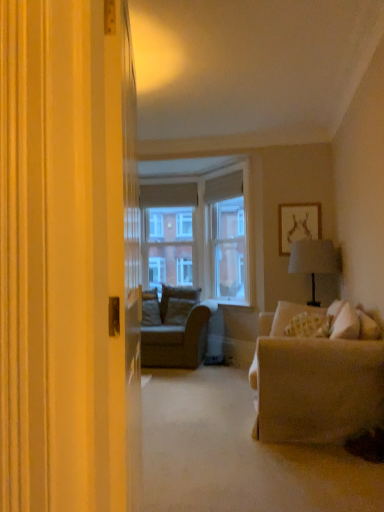
Question: Considering their positions, is textured beige couch at center located in front of or behind clear glass window screen at center, placed as the 1th window screen when sorted from front to back?

Choices:
 (A) front
 (B) behind

Answer: (A)

Question: Is point (205, 335) positioned closer to the camera than point (213, 279)?

Choices:
 (A) closer
 (B) farther

Answer: (A)

Question: Considering the real-world distances, which object is closest to the suede cushion at center, the first pillow positioned from the left?

Choices:
 (A) white matte picture frame at upper right
 (B) clear glass window screen at center, the first window screen from the right
 (C) patterned fabric pillow at right, marked as the 1th pillow in a right-to-left arrangement
 (D) clear glass window screen at center, positioned as the second window screen in right-to-left order
 (E) textured beige couch at center

Answer: (E)

Question: Which is nearer to the white matte picture frame at upper right?

Choices:
 (A) clear glass window screen at center, which is the 2th window screen from back to front
 (B) clear glass window screen at center, which is the first window screen from left to right
 (C) patterned fabric pillow at right, the second pillow viewed from the left
 (D) textured beige couch at center
 (E) suede cushion at center, marked as the 2th pillow in a right-to-left arrangement

Answer: (C)